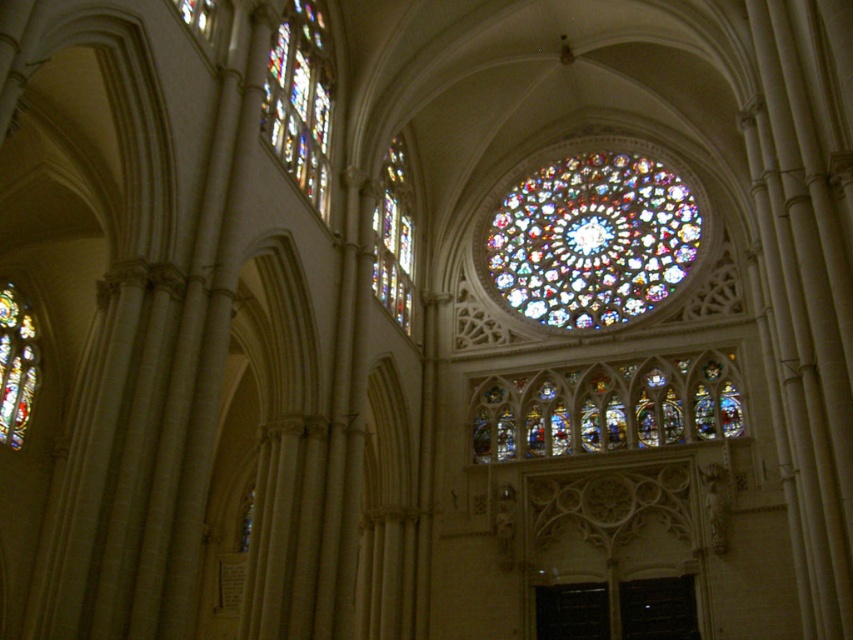
Question: Which point appears closest to the camera in this image?

Choices:
 (A) (322, 192)
 (B) (642, 392)
 (C) (22, 394)
 (D) (410, 275)

Answer: (A)

Question: Which point appears farthest from the camera in this image?

Choices:
 (A) (402, 288)
 (B) (515, 440)

Answer: (A)

Question: From the image, what is the correct spatial relationship of stained glass windows at center in relation to stained glass window at left?

Choices:
 (A) above
 (B) below

Answer: (B)

Question: Is stained glass at upper left smaller than stained glass window at left?

Choices:
 (A) no
 (B) yes

Answer: (A)

Question: Does multicolored stained glass at center appear over stained glass windows at center?

Choices:
 (A) yes
 (B) no

Answer: (A)

Question: Estimate the real-world distances between objects in this image. Which object is closer to the multicolored stained glass at center?

Choices:
 (A) stained glass window at left
 (B) stained glass windows at center
 (C) clear glass window at upper left

Answer: (B)